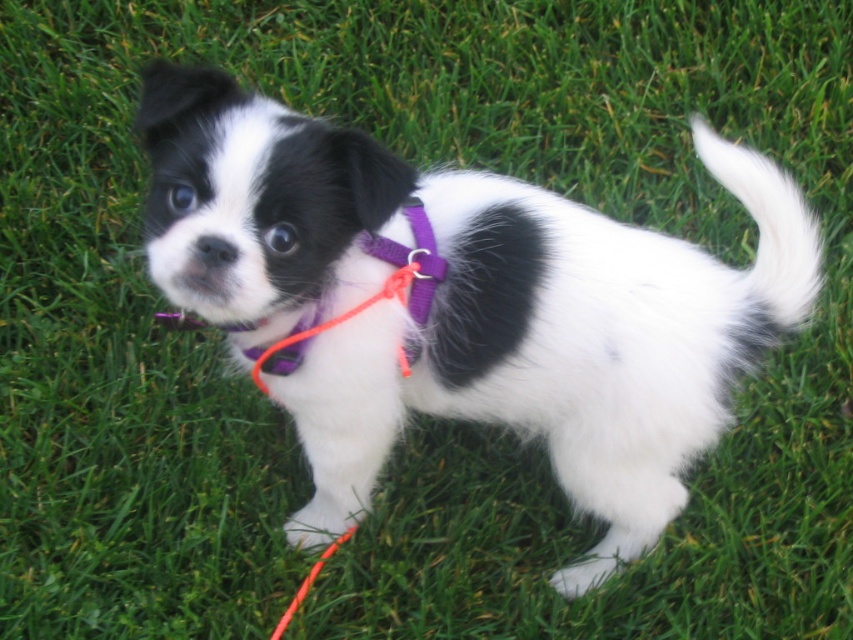
Question: From the image, what is the correct spatial relationship of black and white fur at center in relation to purple fabric neckband at center?

Choices:
 (A) right
 (B) left

Answer: (A)

Question: Which of the following is the closest to the observer?

Choices:
 (A) (421, 257)
 (B) (166, 260)

Answer: (B)

Question: Which point is closer to the camera?

Choices:
 (A) (265, 369)
 (B) (598, 376)

Answer: (A)

Question: Is black and white fur at center bigger than purple fabric neckband at center?

Choices:
 (A) yes
 (B) no

Answer: (A)

Question: Is black and white fur at center thinner than purple fabric neckband at center?

Choices:
 (A) no
 (B) yes

Answer: (A)